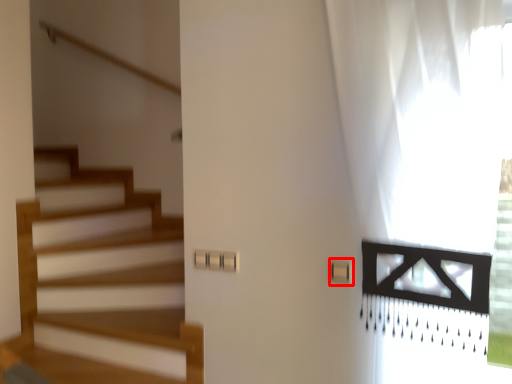
Question: Considering the relative positions of light switch (annotated by the red box) and curtain in the image provided, where is light switch (annotated by the red box) located with respect to the staircase?

Choices:
 (A) right
 (B) left

Answer: (B)